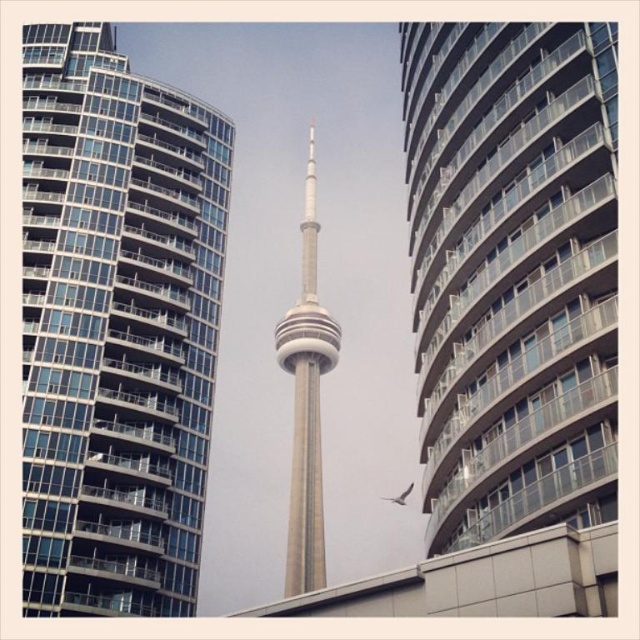
Question: Can you confirm if smooth glass building at center is positioned to the left of gray concrete tower at center?

Choices:
 (A) yes
 (B) no

Answer: (B)

Question: Estimate the real-world distances between objects in this image. Which object is farther from the glassy steel building at left?

Choices:
 (A) gray concrete tower at center
 (B) smooth glass building at center

Answer: (A)

Question: Can you confirm if smooth glass building at center is thinner than gray concrete tower at center?

Choices:
 (A) yes
 (B) no

Answer: (A)

Question: Estimate the real-world distances between objects in this image. Which object is closer to the glassy steel building at left?

Choices:
 (A) gray concrete tower at center
 (B) smooth glass building at center

Answer: (B)

Question: Is smooth glass building at center below gray concrete tower at center?

Choices:
 (A) yes
 (B) no

Answer: (B)

Question: Estimate the real-world distances between objects in this image. Which object is farther from the glassy steel building at left?

Choices:
 (A) gray concrete tower at center
 (B) smooth glass building at center

Answer: (A)